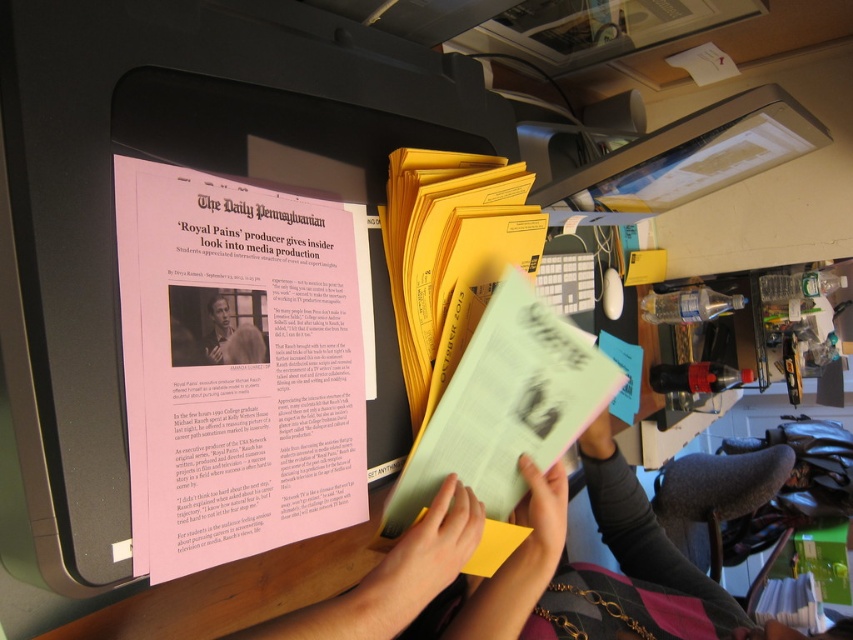
Between pink paper at center and smooth skin portrait at center, which one appears on the left side from the viewer's perspective?

smooth skin portrait at center is more to the left.

Which is above, pink paper at center or smooth skin portrait at center?

smooth skin portrait at center

This screenshot has width=853, height=640. I want to click on pink paper at center, so click(x=239, y=365).

Find the location of a particular element. This screenshot has width=853, height=640. pink paper at center is located at coordinates (239, 365).

In the scene shown: Can you confirm if pink paper at center is thinner than light green paper at center?

Indeed, pink paper at center has a lesser width compared to light green paper at center.

What do you see at coordinates (239, 365) in the screenshot? Image resolution: width=853 pixels, height=640 pixels. I see `pink paper at center` at bounding box center [239, 365].

This screenshot has width=853, height=640. Find the location of `pink paper at center`. pink paper at center is located at coordinates (239, 365).

Is matte black monitor at center to the right of pink paper at center from the viewer's perspective?

No, matte black monitor at center is not to the right of pink paper at center.

This screenshot has width=853, height=640. What do you see at coordinates (173, 163) in the screenshot?
I see `matte black monitor at center` at bounding box center [173, 163].

Between point (125, 44) and point (335, 467), which one is positioned behind?

The point (335, 467) is behind.

This screenshot has width=853, height=640. Identify the location of matte black monitor at center. (173, 163).